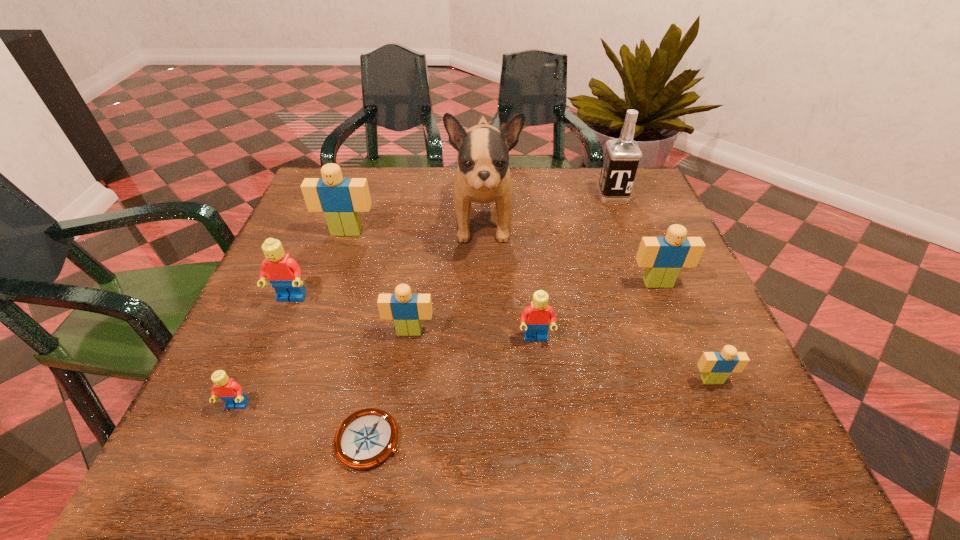
This screenshot has height=540, width=960. I want to click on the second smallest red Lego, so click(536, 317).

The width and height of the screenshot is (960, 540). In order to click on the fifth Lego from left to right in this screenshot , I will do `click(536, 317)`.

This screenshot has height=540, width=960. Identify the location of the nearest beige Lego. (715, 366).

Find the location of a particular element. This screenshot has width=960, height=540. the eighth farthest object is located at coordinates (715, 366).

Identify the location of the nearest red Lego. The height and width of the screenshot is (540, 960). (227, 389).

This screenshot has height=540, width=960. Find the location of `the smallest red Lego`. the smallest red Lego is located at coordinates (227, 389).

This screenshot has height=540, width=960. What are the coordinates of `the shortest object` in the screenshot? It's located at (367, 437).

What are the coordinates of `free space located at the face of the tallest object` in the screenshot? It's located at (484, 289).

The image size is (960, 540). Identify the location of vacant area situated 0.240m on the front label of the second tallest object. (639, 266).

Locate an element on the screen. The width and height of the screenshot is (960, 540). vacant position located on the face of the farthest beige Lego is located at coordinates (325, 291).